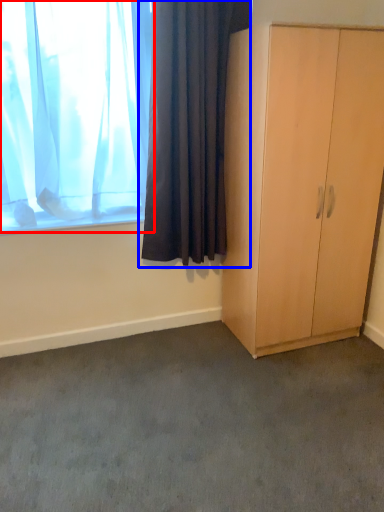
Question: Among these objects, which one is farthest to the camera, curtain (highlighted by a red box) or curtain (highlighted by a blue box)?

Choices:
 (A) curtain
 (B) curtain

Answer: (B)